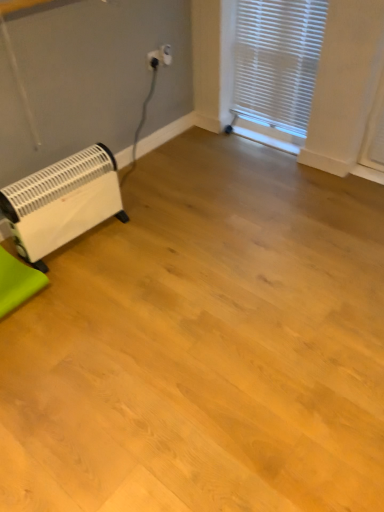
This screenshot has height=512, width=384. What are the coordinates of `free space in front of white plastic heater at lower left` in the screenshot? It's located at [93, 290].